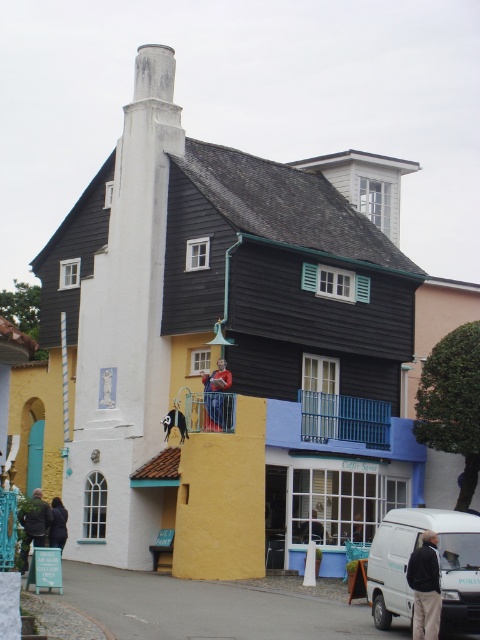
Question: Can you confirm if blue metal railing at center is wider than denim pants at center?

Choices:
 (A) yes
 (B) no

Answer: (A)

Question: Which object is farther from the camera taking this photo?

Choices:
 (A) denim pants at center
 (B) black leather jacket at lower left
 (C) black leather jacket at lower right
 (D) blue metal railing at center

Answer: (D)

Question: Which of these objects is positioned farthest from the blue painted wood balcony at center?

Choices:
 (A) blue metal railing at center
 (B) denim pants at center
 (C) white matte van at center

Answer: (C)

Question: Which of the following is the closest to the observer?

Choices:
 (A) (385, 408)
 (B) (424, 602)
 (C) (207, 422)
 (D) (208, 426)

Answer: (B)

Question: Does white matte van at center have a smaller size compared to blue painted wood balcony at center?

Choices:
 (A) yes
 (B) no

Answer: (B)

Question: Is white matte van at center positioned behind blue painted wood balcony at center?

Choices:
 (A) no
 (B) yes

Answer: (A)